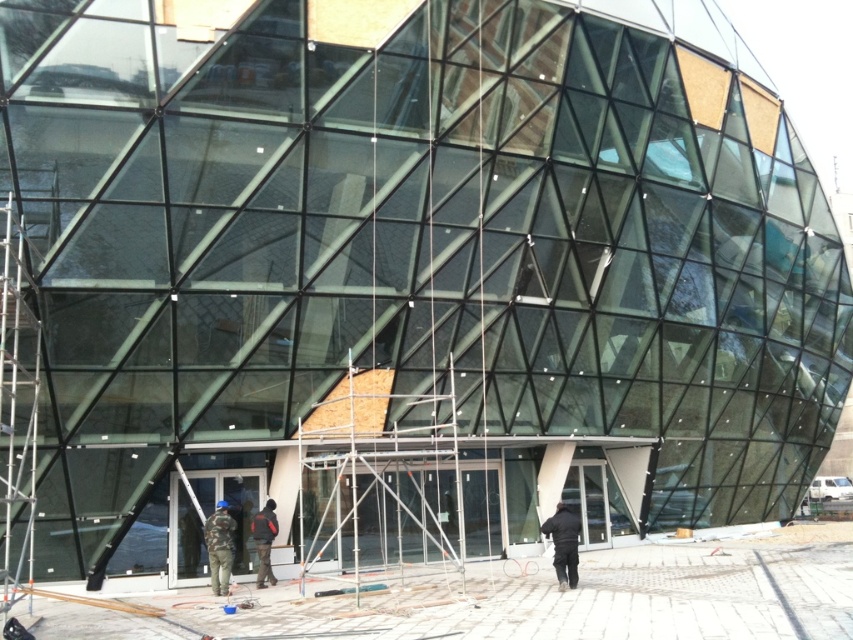
You are a construction supervisor checking the safety gear of workers. You notice two jackets near the entrance area. Which jacket is narrower in width between the black matte jacket at lower center and the dark blue jacket at center?

The black matte jacket at lower center is narrower in width compared to the dark blue jacket at center.

You are a construction supervisor who needs to ensure safety distances between workers. You see two workers wearing a camouflage fabric jacket at lower center and a dark blue jacket at center. Based on the given information, can you confirm if these two workers are maintaining a safe distance of at least 3 feet apart?

The camouflage fabric jacket at lower center and dark blue jacket at center are 3.50 feet apart from each other, which is more than the required 3 feet distance. Therefore, they are maintaining a safe distance.

You are a delivery person who needs to hand over a package to the construction workers. You see the black matte jacket at lower center and the camouflage fabric jacket at lower center in the scene. What is the minimum distance you need to walk to reach both jackets from your current position at the entrance?

The minimum distance you need to walk is 7.75 meters, as the black matte jacket at lower center and camouflage fabric jacket at lower center are 7.75 meters apart from each other.